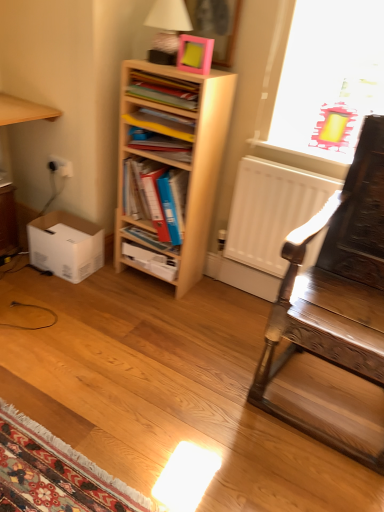
Where is `free area in between light wood bookshelf at center and dark brown polished wood chair at right`? The image size is (384, 512). free area in between light wood bookshelf at center and dark brown polished wood chair at right is located at coordinates (211, 327).